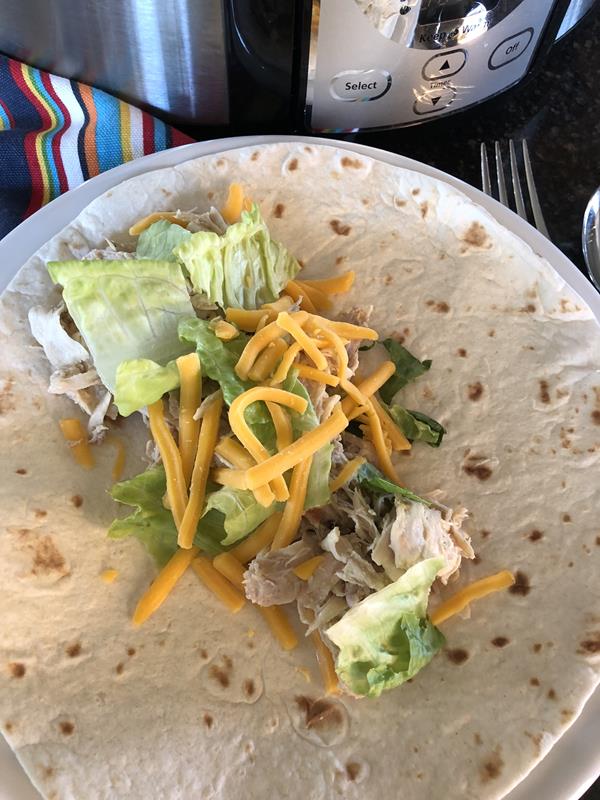
Locate an element on the screen. The width and height of the screenshot is (600, 800). fork is located at coordinates (531, 186).